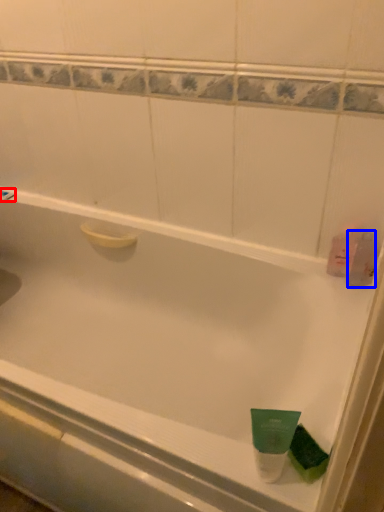
Question: Which object is further to the camera taking this photo, shower (highlighted by a red box) or mouthwash (highlighted by a blue box)?

Choices:
 (A) shower
 (B) mouthwash

Answer: (A)